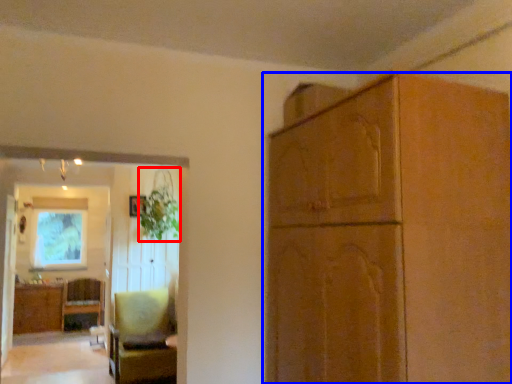
Question: Among these objects, which one is nearest to the camera, plant (highlighted by a red box) or cabinetry (highlighted by a blue box)?

Choices:
 (A) plant
 (B) cabinetry

Answer: (B)